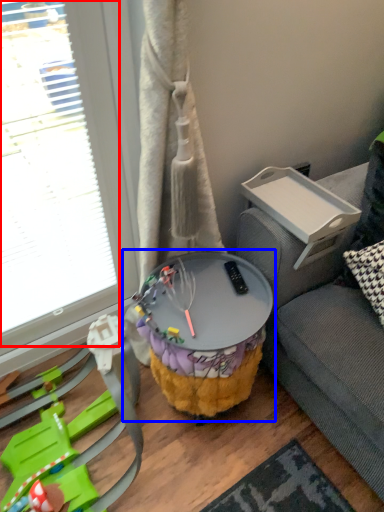
Question: Which of the following is the closest to the observer, glass door (highlighted by a red box) or table (highlighted by a blue box)?

Choices:
 (A) glass door
 (B) table

Answer: (A)